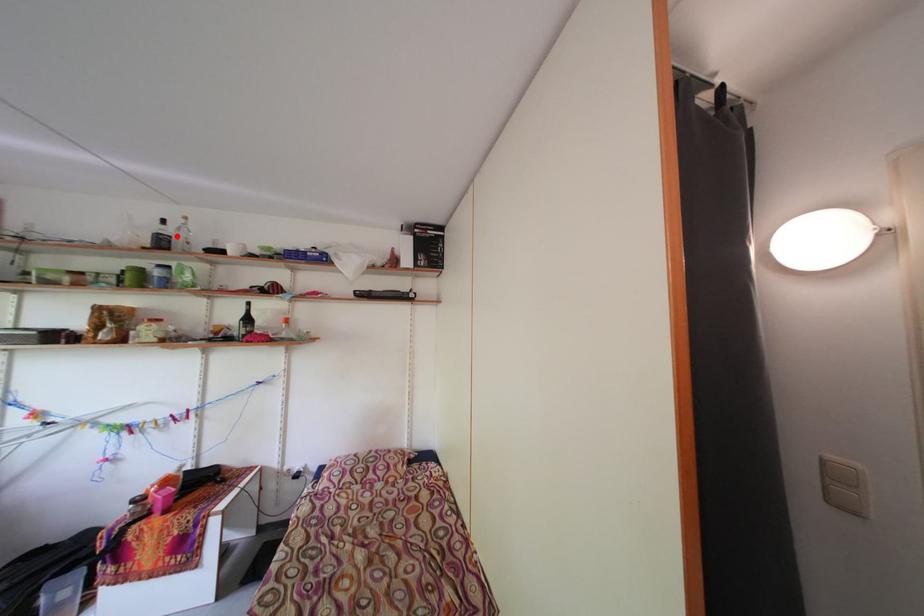
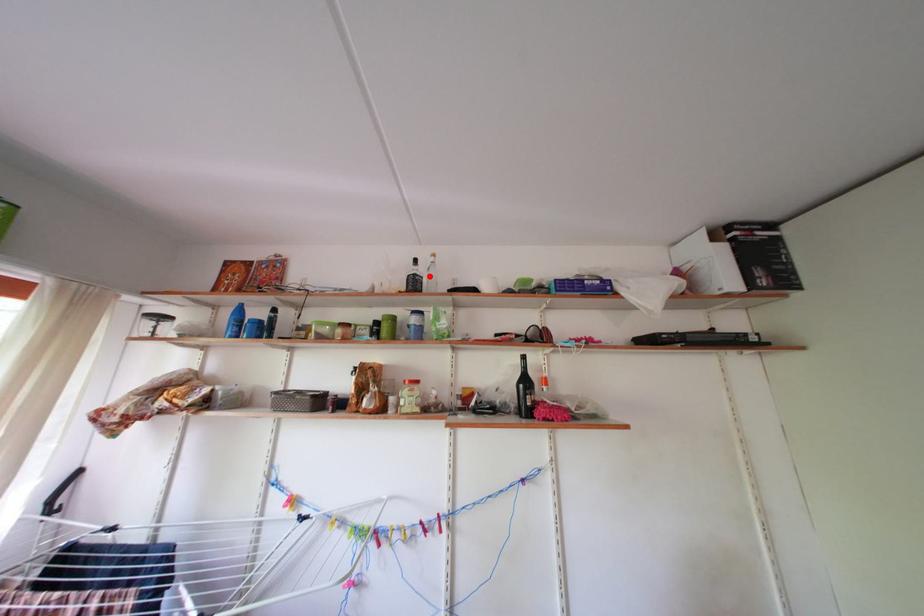
I am providing you with two images of the same scene from different viewpoints. A red point is marked on the first image and another point is marked on the second image. Is the red point in image1 aligned with the point shown in image2?

Yes